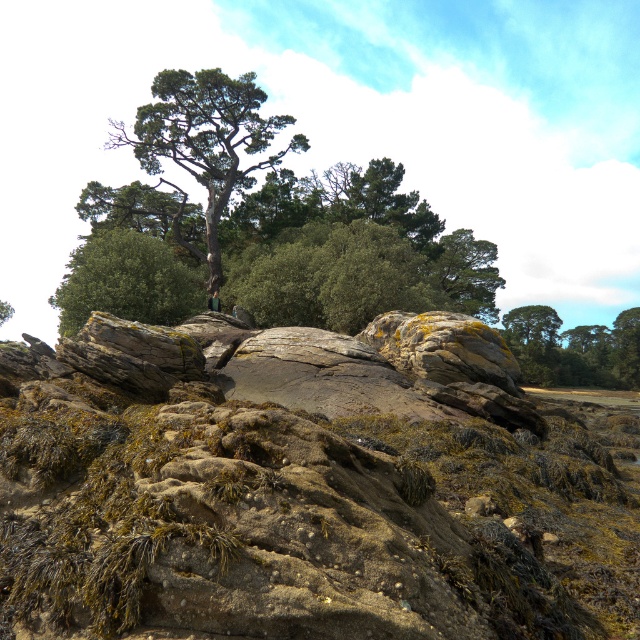
You are an ornithologist observing two trees in a coastal landscape. You see the green rough bark tree at upper center and the green matte tree at upper center. Which tree would provide a higher vantage point for nesting birds?

The green rough bark tree at upper center is much taller than the green matte tree at upper center, so it would provide a higher vantage point for nesting birds.

You are standing at the edge of the coastal landscape looking at the scene. There are two points marked in the image, point 1 at coordinates point (209,120) and point 2 at coordinates point (464,273). Which point is closer to you?

Point (209,120) is closer to the viewer than point (464,273).